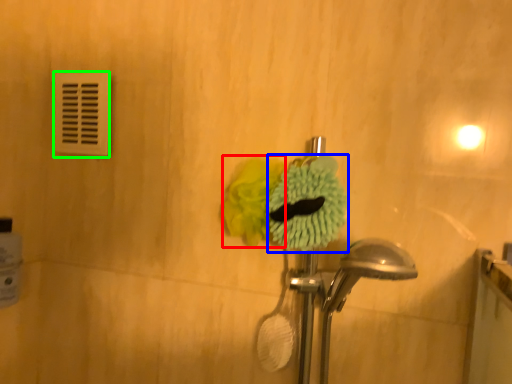
Question: Considering the real-world distances, which object is closest to flower (highlighted by a red box)? flower (highlighted by a blue box) or light switch (highlighted by a green box).

Choices:
 (A) flower
 (B) light switch

Answer: (A)